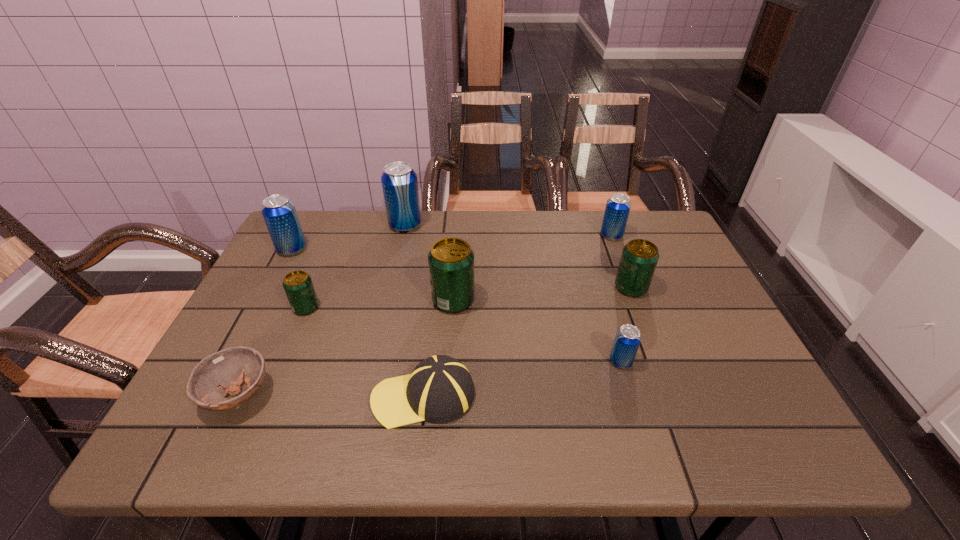
What are the coordinates of `free spot that satisfies the following two spatial constraints: 1. on the back side of the rightmost blue beer can; 2. on the left side of the rightmost green beer can` in the screenshot? It's located at (612, 235).